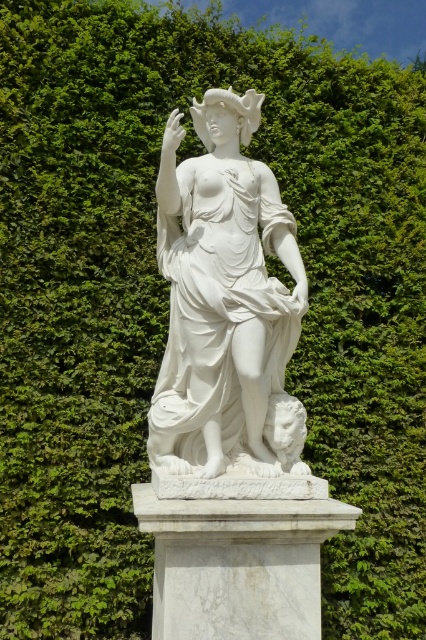
You are an art conservator assessing the statue and its pedestal. Given that the pedestal is designed to support the statue, does the white marble statue at center take up more or less space than the white marble pedestal at center?

The white marble statue at center occupies less space than the white marble pedestal at center, so it takes up less space.

You are standing in front of a classical marble statue set against dense green foliage. The statue is mounted on a pedestal. There is a point at coordinates (221,296). What does this point represent?

The point at coordinates (221,296) represents the white marble statue at center.